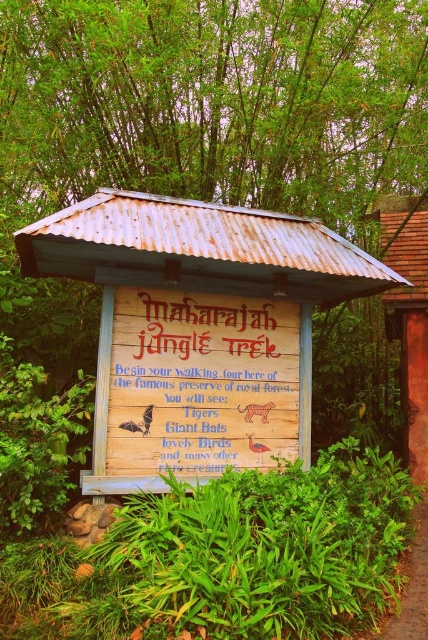
Which of these two, wooden sign at center or brown dirt path at lower right, stands taller?

Result: Standing taller between the two is wooden sign at center.

Does wooden sign at center have a greater height compared to brown dirt path at lower right?

Correct, wooden sign at center is much taller as brown dirt path at lower right.

In order to click on wooden sign at center in this screenshot , I will do `click(201, 381)`.

The width and height of the screenshot is (428, 640). Identify the location of wooden sign at center. (201, 381).

Is point (403, 381) farther from viewer compared to point (407, 584)?

Yes, it is.

Does rusty corrugated metal hut at upper right appear on the right side of brown dirt path at lower right?

Yes, rusty corrugated metal hut at upper right is to the right of brown dirt path at lower right.

Find the location of `rusty corrugated metal hut at upper right`. rusty corrugated metal hut at upper right is located at coordinates (409, 314).

Which is more to the left, wooden sign at center or rusty corrugated metal hut at upper right?

From the viewer's perspective, wooden sign at center appears more on the left side.

Does wooden sign at center have a lesser height compared to rusty corrugated metal hut at upper right?

Indeed, wooden sign at center has a lesser height compared to rusty corrugated metal hut at upper right.

Find the location of a particular element. The width and height of the screenshot is (428, 640). wooden sign at center is located at coordinates (201, 381).

In order to click on wooden sign at center in this screenshot , I will do `click(201, 381)`.